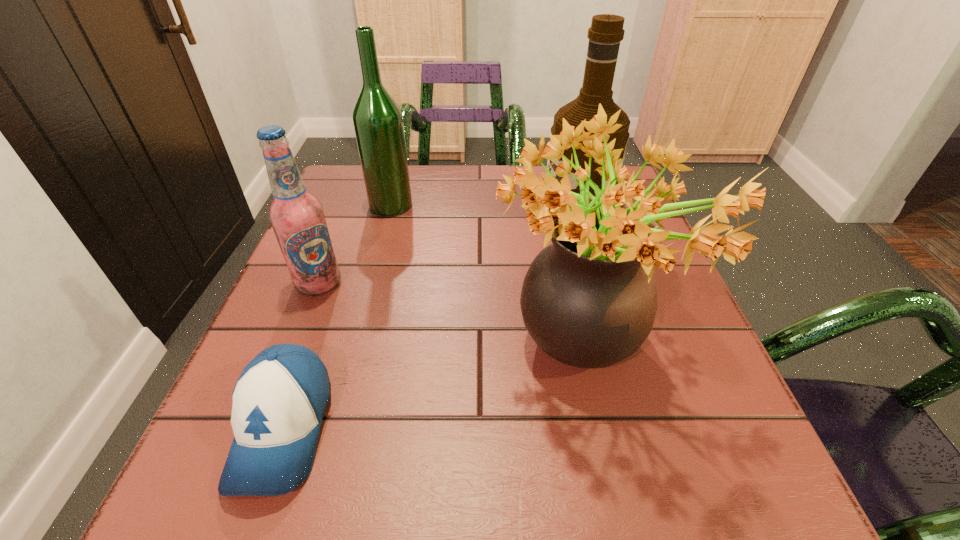
In order to click on vacant area between the second alcohol from right to left and the flower arrangement in this screenshot , I will do `click(487, 280)`.

This screenshot has width=960, height=540. Find the location of `free area in between the second alcohol from left to right and the shortest alcohol`. free area in between the second alcohol from left to right and the shortest alcohol is located at coordinates (355, 244).

Identify which object is the fourth nearest to the second alcohol from right to left. Please provide its 2D coordinates. Your answer should be formatted as a tuple, i.e. [(x, y)], where the tuple contains the x and y coordinates of a point satisfying the conditions above.

[(279, 400)]

Where is `object that can be found as the closest to the rightmost alcohol`? This screenshot has width=960, height=540. object that can be found as the closest to the rightmost alcohol is located at coordinates (589, 300).

Identify which alcohol is the closest to the nearest alcohol. Please provide its 2D coordinates. Your answer should be formatted as a tuple, i.e. [(x, y)], where the tuple contains the x and y coordinates of a point satisfying the conditions above.

[(377, 119)]

Identify which alcohol is the second closest to the leftmost alcohol. Please provide its 2D coordinates. Your answer should be formatted as a tuple, i.e. [(x, y)], where the tuple contains the x and y coordinates of a point satisfying the conditions above.

[(606, 32)]

Where is `vacant space that satisfies the following two spatial constraints: 1. on the label of the rightmost alcohol; 2. on the front side of the flower arrangement`? The width and height of the screenshot is (960, 540). vacant space that satisfies the following two spatial constraints: 1. on the label of the rightmost alcohol; 2. on the front side of the flower arrangement is located at coordinates (615, 355).

You are a GUI agent. You are given a task and a screenshot of the screen. Output one action in this format:
    pyautogui.click(x=<x>, y=<y>)
    Task: Click on the free space that satisfies the following two spatial constraints: 1. on the back side of the second alcohol from left to right; 2. on the right side of the nearest alcohol
    Image resolution: width=960 pixels, height=540 pixels.
    Given the screenshot: What is the action you would take?
    pyautogui.click(x=350, y=205)

At what (x,y) coordinates should I click in order to perform the action: click on free space that satisfies the following two spatial constraints: 1. on the label of the rightmost alcohol; 2. on the front-facing side of the shortest object. Please return your answer as a coordinate pair (x, y). Image resolution: width=960 pixels, height=540 pixels. Looking at the image, I should click on (636, 429).

Locate an element on the screen. vacant point that satisfies the following two spatial constraints: 1. on the label of the rightmost alcohol; 2. on the front side of the shortest alcohol is located at coordinates (595, 283).